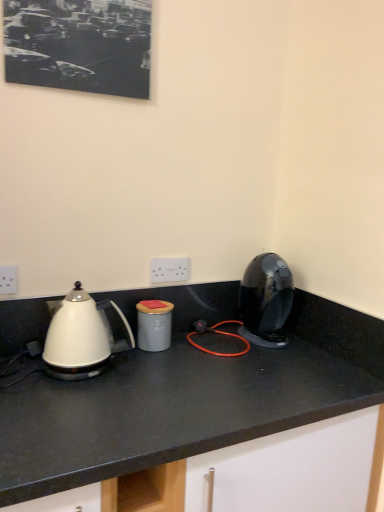
Locate an element on the screen. The width and height of the screenshot is (384, 512). free space in front of white glossy kettle at left is located at coordinates (79, 402).